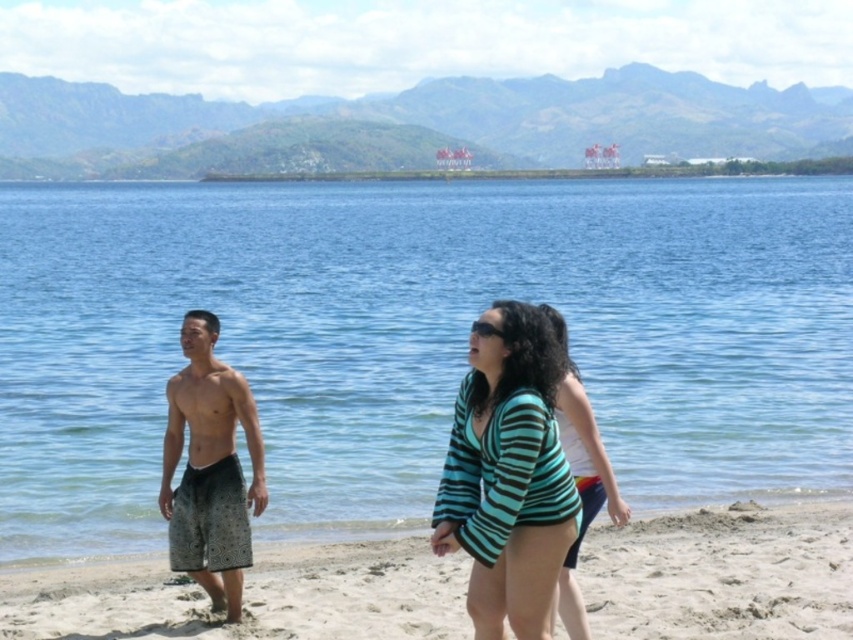
Question: Is light beige sand at lower center behind smooth skin torso at center?

Choices:
 (A) yes
 (B) no

Answer: (B)

Question: Which of these objects is positioned farthest from the printed fabric shorts at left?

Choices:
 (A) light beige sand at lower center
 (B) blue water at center

Answer: (B)

Question: Which point is farther to the camera?

Choices:
 (A) (190, 512)
 (B) (593, 496)
 (C) (216, 420)

Answer: (C)

Question: Which object appears closest to the camera in this image?

Choices:
 (A) teal striped sweater at center
 (B) blue water at center

Answer: (A)

Question: Does light beige sand at lower center appear under smooth skin torso at center?

Choices:
 (A) no
 (B) yes

Answer: (B)

Question: Can you confirm if teal striped swimsuit at center is bigger than smooth skin torso at center?

Choices:
 (A) yes
 (B) no

Answer: (A)